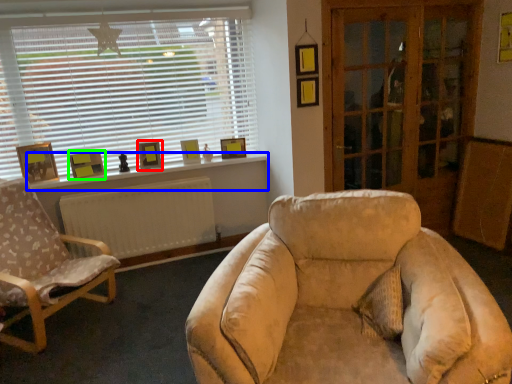
Question: Based on their relative distances, which object is farther from picture frame (highlighted by a red box)? Choose from window sill (highlighted by a blue box) and picture frame (highlighted by a green box).

Choices:
 (A) window sill
 (B) picture frame

Answer: (B)